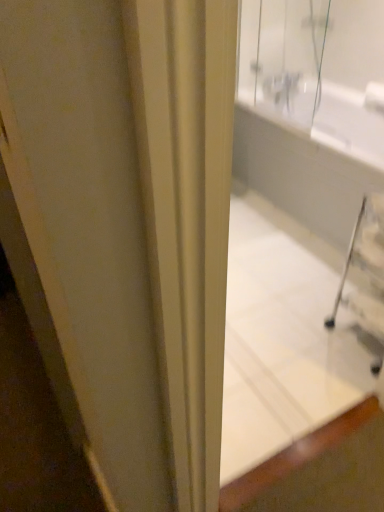
Question: Is white glossy bathtub at upper right smaller than white glossy bathtub at center?

Choices:
 (A) no
 (B) yes

Answer: (A)

Question: Considering the relative sizes of white glossy bathtub at upper right and white glossy bathtub at center in the image provided, is white glossy bathtub at upper right taller than white glossy bathtub at center?

Choices:
 (A) no
 (B) yes

Answer: (A)

Question: Is white glossy bathtub at upper right wider than white glossy bathtub at center?

Choices:
 (A) no
 (B) yes

Answer: (B)

Question: Would you say white glossy bathtub at upper right contains white glossy bathtub at center?

Choices:
 (A) yes
 (B) no

Answer: (B)

Question: From a real-world perspective, is white glossy bathtub at upper right on white glossy bathtub at center?

Choices:
 (A) no
 (B) yes

Answer: (A)

Question: From a real-world perspective, is white glossy bathtub at upper right located beneath white glossy bathtub at center?

Choices:
 (A) yes
 (B) no

Answer: (A)

Question: Is white glossy bathtub at center to the left of white glossy bathtub at upper right from the viewer's perspective?

Choices:
 (A) no
 (B) yes

Answer: (B)

Question: From a real-world perspective, is white glossy bathtub at center physically below white glossy bathtub at upper right?

Choices:
 (A) yes
 (B) no

Answer: (B)

Question: Would you say white glossy bathtub at center is a long distance from white glossy bathtub at upper right?

Choices:
 (A) yes
 (B) no

Answer: (B)

Question: Does white glossy bathtub at center have a lesser height compared to white glossy bathtub at upper right?

Choices:
 (A) no
 (B) yes

Answer: (A)

Question: Is white glossy bathtub at center aimed at white glossy bathtub at upper right?

Choices:
 (A) yes
 (B) no

Answer: (B)

Question: Is white glossy bathtub at center located outside white glossy bathtub at upper right?

Choices:
 (A) yes
 (B) no

Answer: (A)

Question: Considering the positions of point (306, 121) and point (372, 174), is point (306, 121) closer or farther from the camera than point (372, 174)?

Choices:
 (A) closer
 (B) farther

Answer: (B)